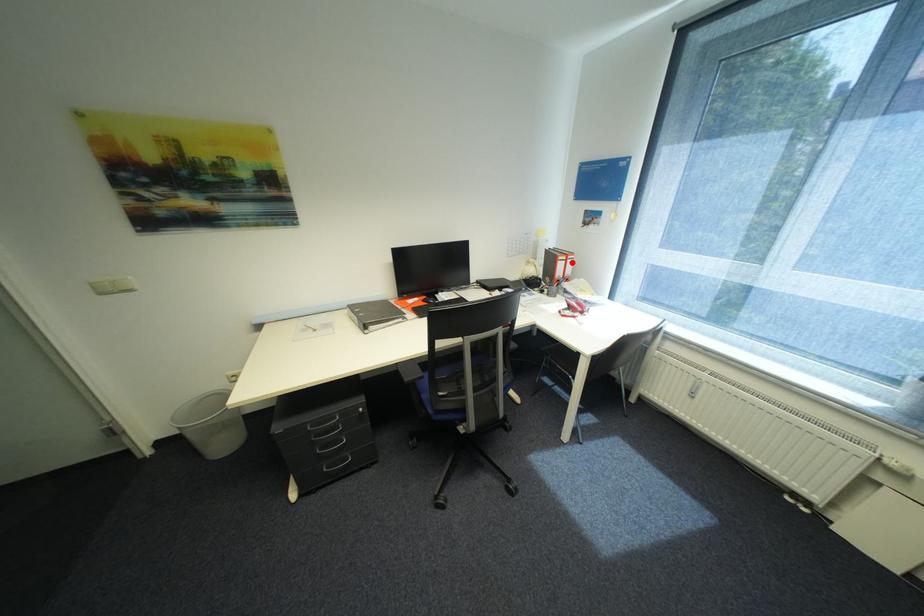
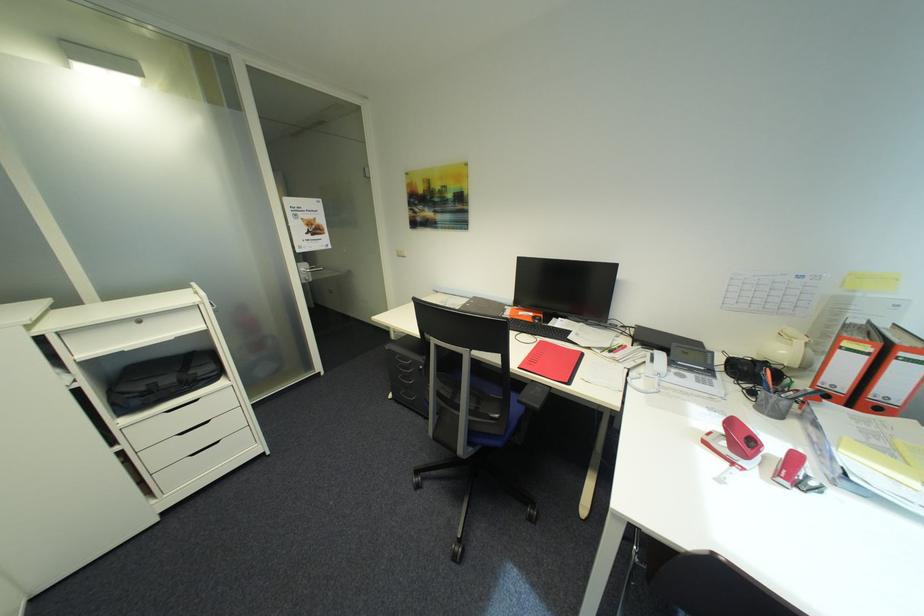
Find the pixel in the second image that matches the highlighted location in the first image.

(872, 359)